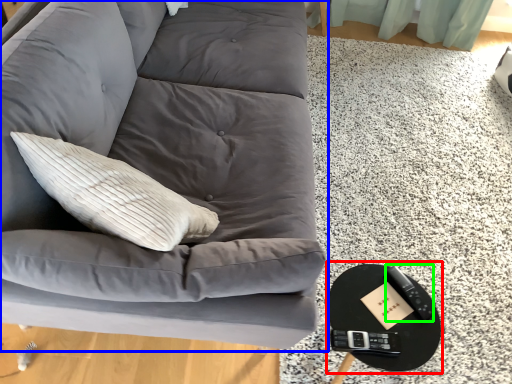
Question: Which object is positioned closest to round table (highlighted by a red box)? Select from studio couch (highlighted by a blue box) and remote (highlighted by a green box).

Choices:
 (A) studio couch
 (B) remote

Answer: (B)